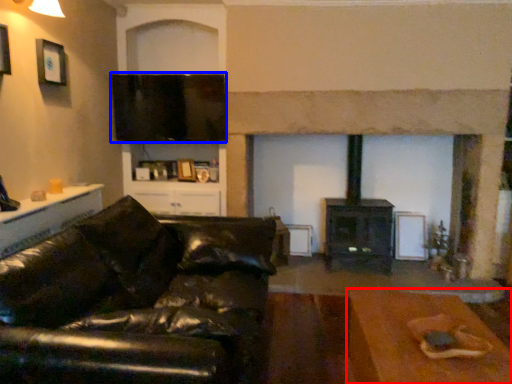
Question: Among these objects, which one is nearest to the camera, table (highlighted by a red box) or window screen (highlighted by a blue box)?

Choices:
 (A) table
 (B) window screen

Answer: (A)